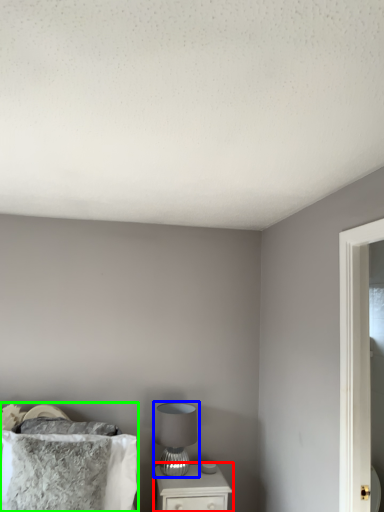
Question: Which object is the closest to the nightstand (highlighted by a red box)? Choose among these: table lamp (highlighted by a blue box) or bed (highlighted by a green box).

Choices:
 (A) table lamp
 (B) bed

Answer: (A)